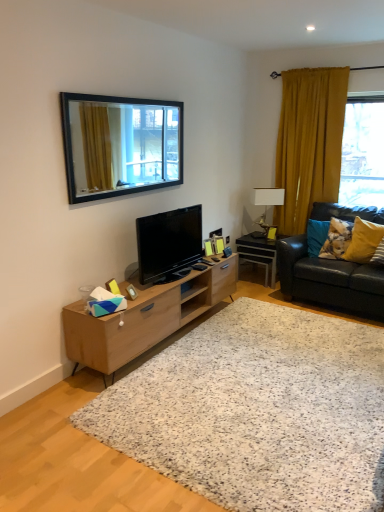
Question: Relative to fluffy fabric pillow at right, arranged as the first pillow when viewed from the left, is transparent glass window at right in front or behind?

Choices:
 (A) front
 (B) behind

Answer: (B)

Question: From their relative heights in the image, would you say transparent glass window at right is taller or shorter than fluffy fabric pillow at right, arranged as the first pillow when viewed from the left?

Choices:
 (A) tall
 (B) short

Answer: (A)

Question: Estimate the real-world distances between objects in this image. Which object is farther from the yellow fabric pillow at right, placed as the 1th pillow when sorted from right to left?

Choices:
 (A) fluffy fabric pillow at right, arranged as the first pillow when viewed from the left
 (B) black glossy desk at right
 (C) wooden picture frame at center
 (D) black framed mirror at upper center
 (E) matte black tv at center

Answer: (C)

Question: Estimate the real-world distances between objects in this image. Which object is farther from the black leather couch at right?

Choices:
 (A) white ceramic lamp at right
 (B) fluffy fabric pillow at right, the 2th pillow in the right-to-left sequence
 (C) mustard velvet curtain at right
 (D) black glossy desk at right
 (E) black framed mirror at upper center

Answer: (E)